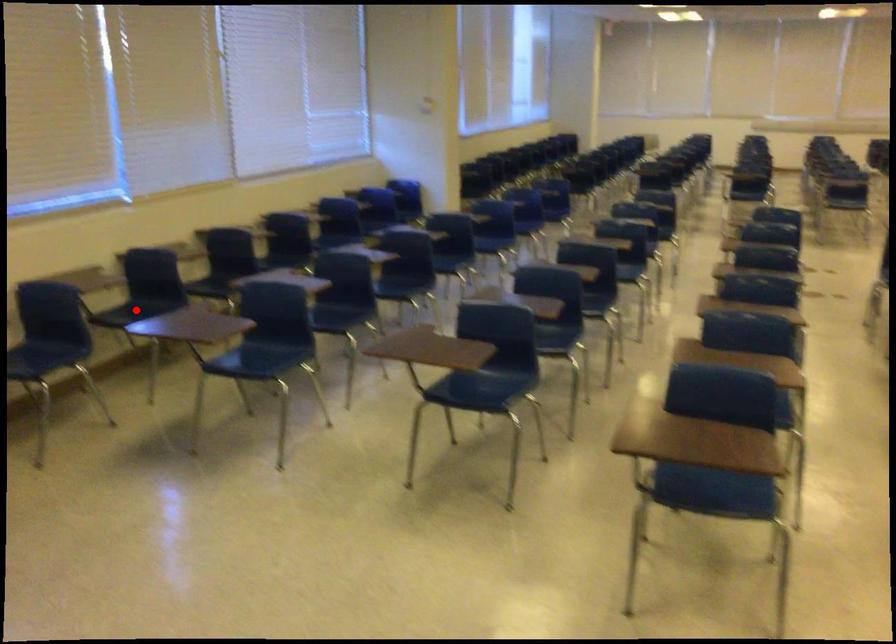
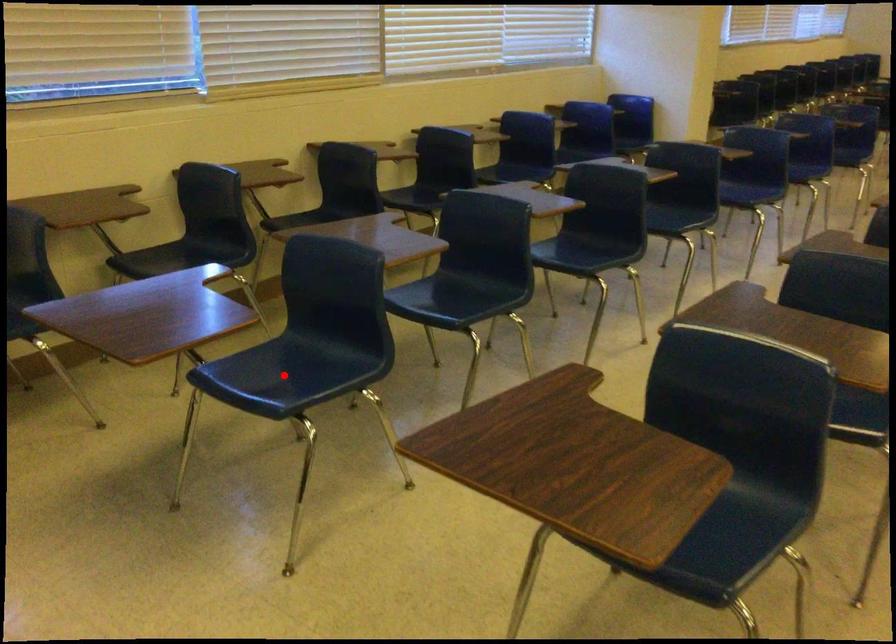
I am providing you with two images of the same scene from different viewpoints. A red point is marked on the first image and another point is marked on the second image. Do the highlighted points in image1 and image2 indicate the same real-world spot?

No